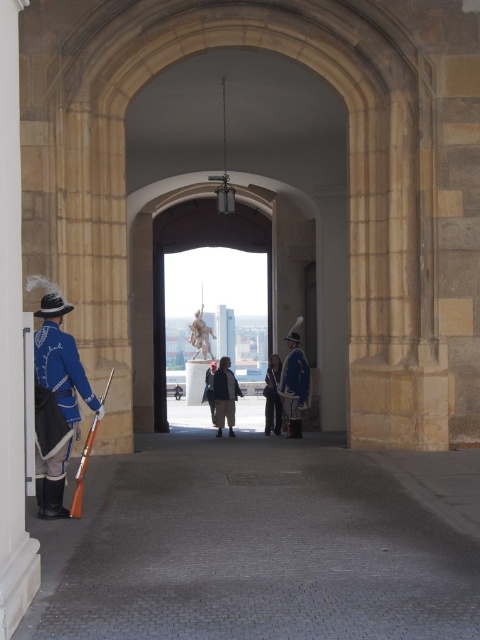
Can you confirm if blue matte uniform at left is bigger than light brown leather jacket at center?

Actually, blue matte uniform at left might be smaller than light brown leather jacket at center.

Is blue matte uniform at left thinner than light brown leather jacket at center?

Correct, blue matte uniform at left's width is less than light brown leather jacket at center's.

This screenshot has width=480, height=640. What do you see at coordinates (61, 369) in the screenshot? I see `blue matte uniform at left` at bounding box center [61, 369].

I want to click on blue matte uniform at left, so click(x=61, y=369).

Can you confirm if light brown leather jacket at center is shorter than blue fabric coat at center?

Yes.

Consider the image. Which is more to the left, light brown leather jacket at center or blue fabric coat at center?

light brown leather jacket at center

Where is `light brown leather jacket at center`? The image size is (480, 640). light brown leather jacket at center is located at coordinates (225, 396).

Is blue fabric uniform at center taller than light brown leather jacket at center?

In fact, blue fabric uniform at center may be shorter than light brown leather jacket at center.

Which is behind, point (296, 400) or point (230, 419)?

Positioned behind is point (230, 419).

I want to click on blue fabric uniform at center, so click(x=295, y=387).